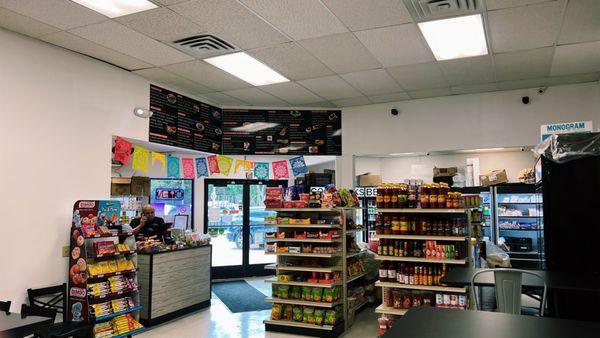
Where is `doors`? The width and height of the screenshot is (600, 338). doors is located at coordinates (226, 197), (257, 187).